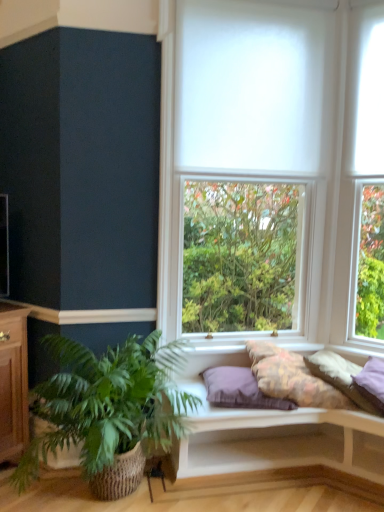
Question: Should I look upward or downward to see white matte window at center?

Choices:
 (A) up
 (B) down

Answer: (A)

Question: Can you confirm if white cushioned bench at lower center is smaller than white matte window at center?

Choices:
 (A) no
 (B) yes

Answer: (A)

Question: From a real-world perspective, is white cushioned bench at lower center positioned under white matte window at center based on gravity?

Choices:
 (A) yes
 (B) no

Answer: (A)

Question: Is white cushioned bench at lower center surrounding white matte window at center?

Choices:
 (A) yes
 (B) no

Answer: (B)

Question: From the image's perspective, would you say white cushioned bench at lower center is positioned over white matte window at center?

Choices:
 (A) no
 (B) yes

Answer: (A)

Question: Are white cushioned bench at lower center and white matte window at center beside each other?

Choices:
 (A) yes
 (B) no

Answer: (B)

Question: Is white cushioned bench at lower center not near white matte window at center?

Choices:
 (A) yes
 (B) no

Answer: (A)

Question: Can you confirm if green woven basket at lower left is positioned to the left of fluffy cotton pillow at center, the second pillow in the left-to-right sequence?

Choices:
 (A) yes
 (B) no

Answer: (A)

Question: Is green woven basket at lower left looking in the opposite direction of fluffy cotton pillow at center, which is the 2th pillow in right-to-left order?

Choices:
 (A) no
 (B) yes

Answer: (A)

Question: Does green woven basket at lower left contain fluffy cotton pillow at center, which is the 2th pillow in right-to-left order?

Choices:
 (A) no
 (B) yes

Answer: (A)

Question: Can you see green woven basket at lower left touching fluffy cotton pillow at center, which is the 2th pillow in right-to-left order?

Choices:
 (A) yes
 (B) no

Answer: (B)

Question: Does green woven basket at lower left have a larger size compared to fluffy cotton pillow at center, which is the 2th pillow in right-to-left order?

Choices:
 (A) no
 (B) yes

Answer: (B)

Question: Considering the relative sizes of green woven basket at lower left and fluffy cotton pillow at center, the second pillow in the left-to-right sequence, in the image provided, is green woven basket at lower left shorter than fluffy cotton pillow at center, the second pillow in the left-to-right sequence,?

Choices:
 (A) no
 (B) yes

Answer: (A)

Question: Can you confirm if purple fabric pillow at center, which ranks as the 3th pillow in right-to-left order, is smaller than white cushioned bench at lower center?

Choices:
 (A) no
 (B) yes

Answer: (B)